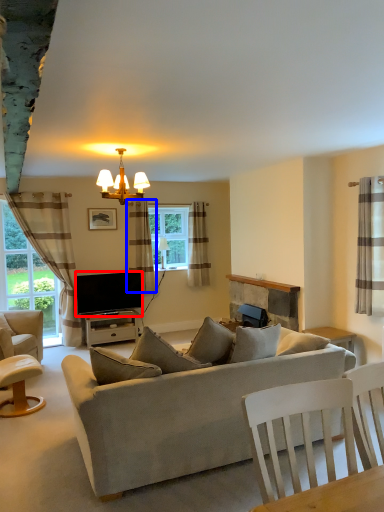
Question: Among these objects, which one is farthest to the camera, television (highlighted by a red box) or curtain (highlighted by a blue box)?

Choices:
 (A) television
 (B) curtain

Answer: (B)